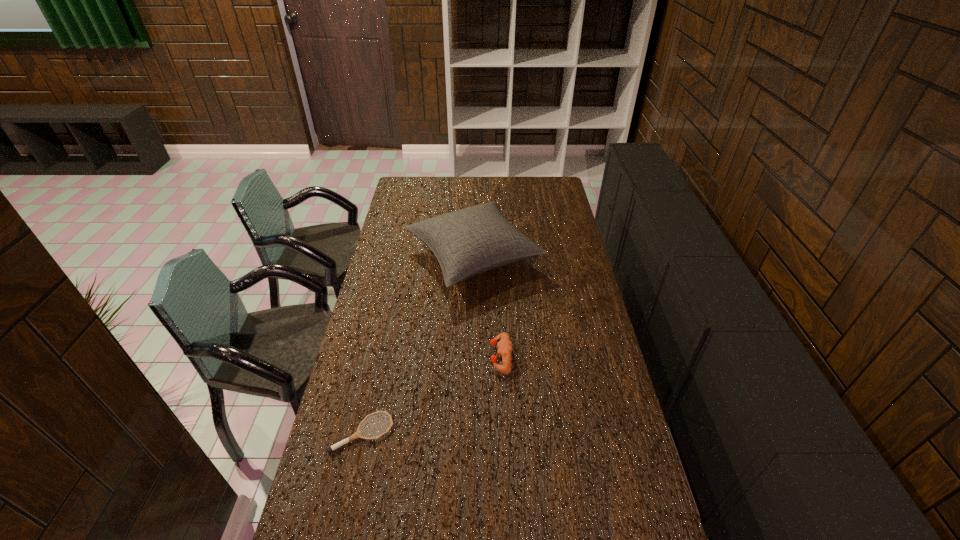
Locate an element on the screen. The image size is (960, 540). vacant space located 0.140m on the front of the shortest object is located at coordinates (347, 506).

At what (x,y) coordinates should I click in order to perform the action: click on cushion located at the left edge. Please return your answer as a coordinate pair (x, y). The image size is (960, 540). Looking at the image, I should click on (467, 242).

You are a GUI agent. You are given a task and a screenshot of the screen. Output one action in this format:
    pyautogui.click(x=<x>, y=<y>)
    Task: Click on the tennis racket at the left edge
    This screenshot has width=960, height=540.
    Given the screenshot: What is the action you would take?
    pyautogui.click(x=357, y=434)

The image size is (960, 540). In the image, there is a desktop. Find the location of `vacant space at the far edge`. vacant space at the far edge is located at coordinates [x=436, y=179].

Where is `vacant space at the left edge of the desktop`? The image size is (960, 540). vacant space at the left edge of the desktop is located at coordinates (407, 234).

The height and width of the screenshot is (540, 960). In the image, there is a desktop. Find the location of `vacant space at the right edge`. vacant space at the right edge is located at coordinates click(x=559, y=317).

What are the coordinates of `vacant region between the puncher and the tennis racket` in the screenshot? It's located at (432, 395).

At what (x,y) coordinates should I click in order to perform the action: click on free space between the tennis racket and the farthest object. Please return your answer as a coordinate pair (x, y). The height and width of the screenshot is (540, 960). Looking at the image, I should click on (418, 345).

This screenshot has height=540, width=960. I want to click on vacant space that's between the second nearest object and the cushion, so click(488, 307).

Find the location of a particular element. This screenshot has width=960, height=540. empty space between the tennis racket and the puncher is located at coordinates [x=432, y=395].